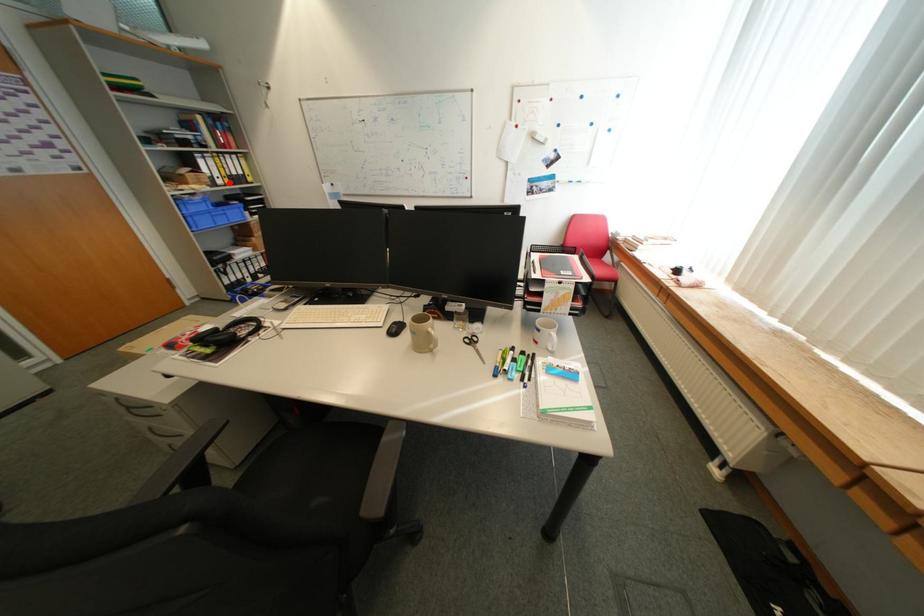
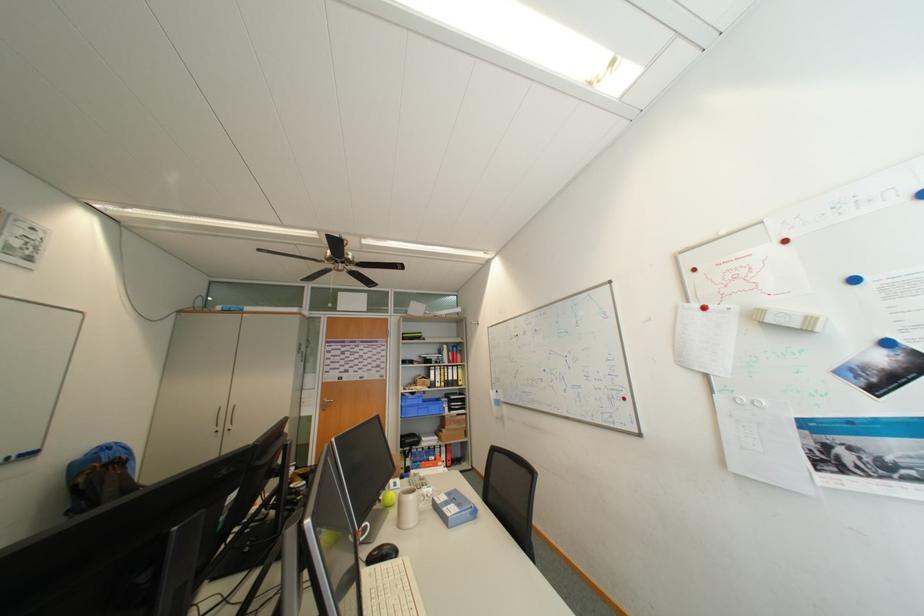
Question: I am providing you with two images of the same scene from different viewpoints. Given a red point in image1, look at the same physical point in image2. Is it:

Choices:
 (A) Closer to the viewpoint
 (B) Farther from the viewpoint

Answer: (B)